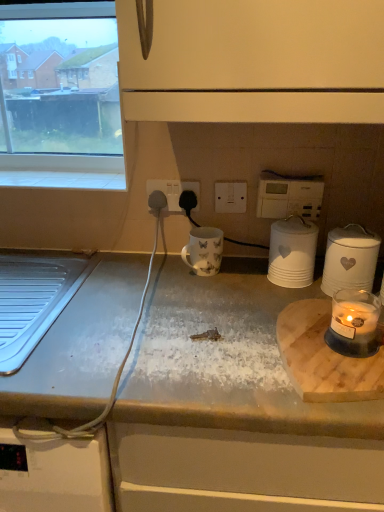
Identify the location of free space to the left of white ceramic jar at right, which ranks as the first kitchen appliance in right-to-left order. The image size is (384, 512). (261, 293).